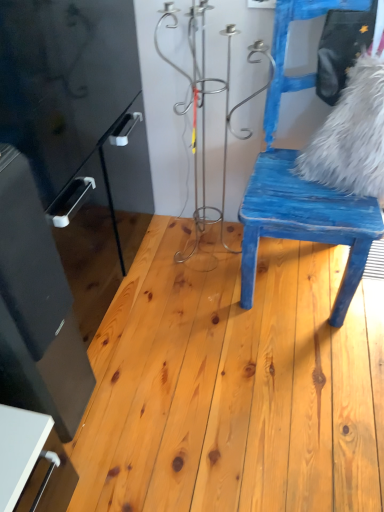
Question: Considering the relative positions of blue distressed wood chair at right and natural wood floor at center in the image provided, is blue distressed wood chair at right to the left of natural wood floor at center from the viewer's perspective?

Choices:
 (A) yes
 (B) no

Answer: (B)

Question: Considering the relative positions of blue distressed wood chair at right and natural wood floor at center in the image provided, is blue distressed wood chair at right to the right of natural wood floor at center from the viewer's perspective?

Choices:
 (A) no
 (B) yes

Answer: (B)

Question: Is blue distressed wood chair at right facing away from natural wood floor at center?

Choices:
 (A) yes
 (B) no

Answer: (B)

Question: From a real-world perspective, is blue distressed wood chair at right beneath natural wood floor at center?

Choices:
 (A) yes
 (B) no

Answer: (B)

Question: Considering the relative sizes of blue distressed wood chair at right and natural wood floor at center in the image provided, is blue distressed wood chair at right thinner than natural wood floor at center?

Choices:
 (A) yes
 (B) no

Answer: (A)

Question: Based on their positions, is natural wood floor at center located to the left or right of blue distressed wood chair at right?

Choices:
 (A) left
 (B) right

Answer: (A)

Question: From their relative heights in the image, would you say natural wood floor at center is taller or shorter than blue distressed wood chair at right?

Choices:
 (A) short
 (B) tall

Answer: (A)

Question: From a real-world perspective, is natural wood floor at center positioned above or below blue distressed wood chair at right?

Choices:
 (A) above
 (B) below

Answer: (B)

Question: Is point (321, 358) closer or farther from the camera than point (251, 220)?

Choices:
 (A) farther
 (B) closer

Answer: (A)

Question: Considering the positions of white fluffy pillow at upper right and blue distressed wood chair at right in the image, is white fluffy pillow at upper right bigger or smaller than blue distressed wood chair at right?

Choices:
 (A) big
 (B) small

Answer: (B)

Question: In terms of height, does white fluffy pillow at upper right look taller or shorter compared to blue distressed wood chair at right?

Choices:
 (A) short
 (B) tall

Answer: (A)

Question: Based on their positions, is white fluffy pillow at upper right located to the left or right of blue distressed wood chair at right?

Choices:
 (A) right
 (B) left

Answer: (A)

Question: Considering their positions, is white fluffy pillow at upper right located in front of or behind blue distressed wood chair at right?

Choices:
 (A) front
 (B) behind

Answer: (B)

Question: Does point (301, 77) appear closer or farther from the camera than point (342, 339)?

Choices:
 (A) closer
 (B) farther

Answer: (B)

Question: From a real-world perspective, relative to natural wood floor at center, is blue distressed wood chair at right vertically above or below?

Choices:
 (A) below
 (B) above

Answer: (B)